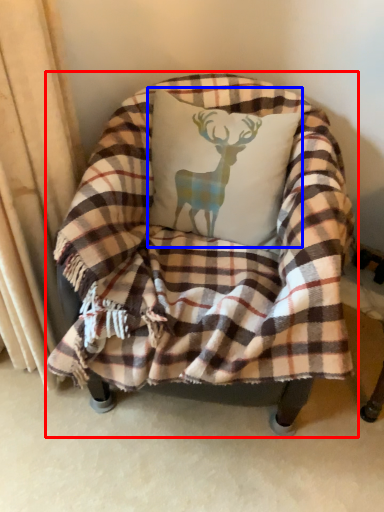
Question: Which object appears farthest to the camera in this image, chair (highlighted by a red box) or throw pillow (highlighted by a blue box)?

Choices:
 (A) chair
 (B) throw pillow

Answer: (B)